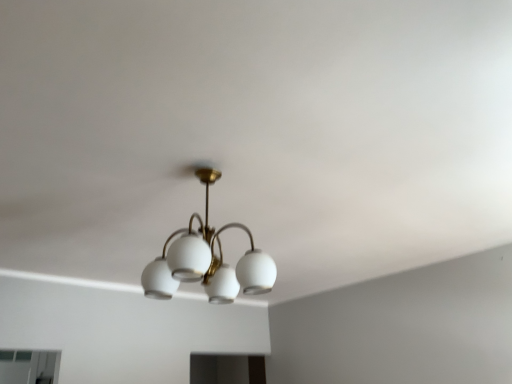
What do you see at coordinates (207, 260) in the screenshot? This screenshot has width=512, height=384. I see `matte white chandelier at center` at bounding box center [207, 260].

Measure the distance between point (148, 265) and camera.

They are 9.96 feet apart.

Locate an element on the screen. The height and width of the screenshot is (384, 512). matte white chandelier at center is located at coordinates (207, 260).

What is the approximate height of matte white chandelier at center?

It is 21.22 inches.

The height and width of the screenshot is (384, 512). Find the location of `matte white chandelier at center`. matte white chandelier at center is located at coordinates (207, 260).